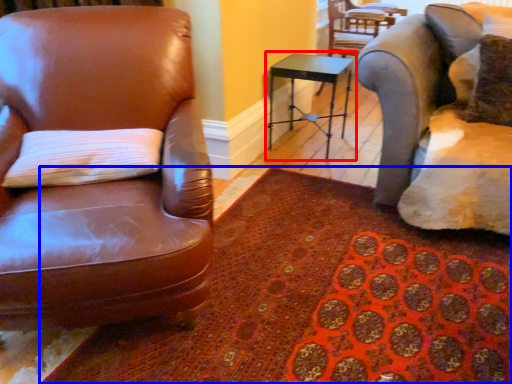
Question: Which of the following is the farthest to the observer, table (highlighted by a red box) or mat (highlighted by a blue box)?

Choices:
 (A) table
 (B) mat

Answer: (A)